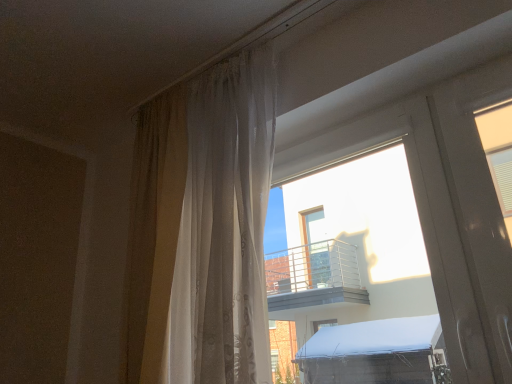
What do you see at coordinates (204, 228) in the screenshot? I see `translucent beige curtain at upper center` at bounding box center [204, 228].

What is the approximate height of translucent beige curtain at upper center?

It is 1.08 meters.

This screenshot has height=384, width=512. What are the coordinates of `translucent beige curtain at upper center` in the screenshot? It's located at (204, 228).

At what (x,y) coordinates should I click in order to perform the action: click on translucent beige curtain at upper center. Please return your answer as a coordinate pair (x, y). This screenshot has width=512, height=384. Looking at the image, I should click on (204, 228).